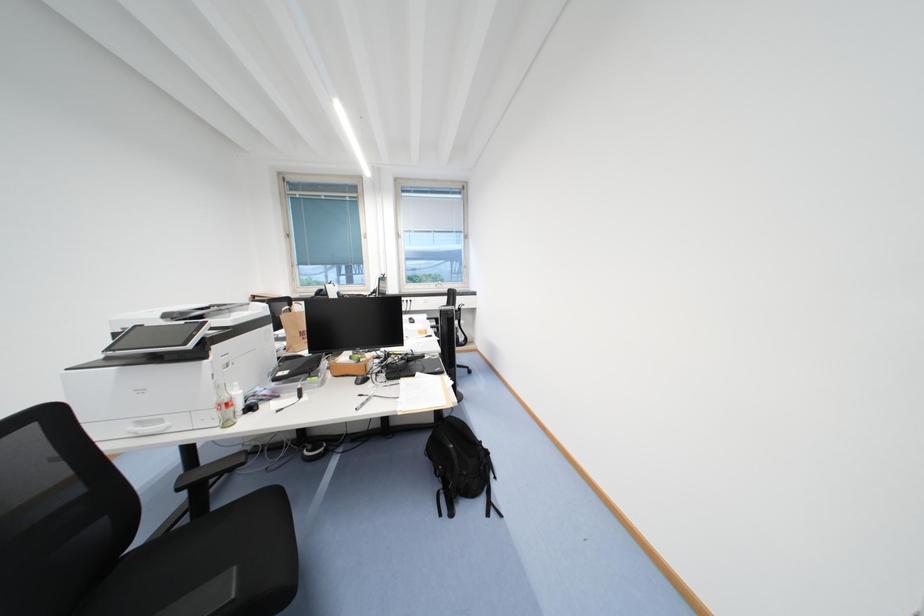
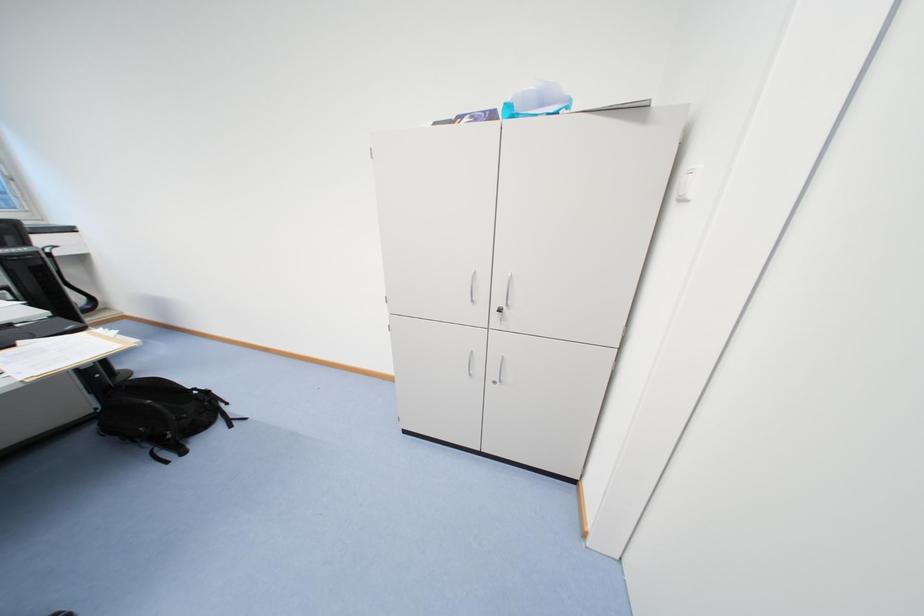
How did the camera likely rotate?

The camera rotated toward right-down.